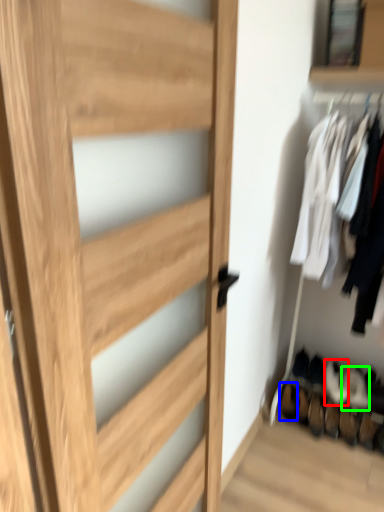
Question: Based on their relative distances, which object is farther from shoe (highlighted by a red box)? Choose from shoe (highlighted by a blue box) and shoe (highlighted by a green box).

Choices:
 (A) shoe
 (B) shoe

Answer: (A)